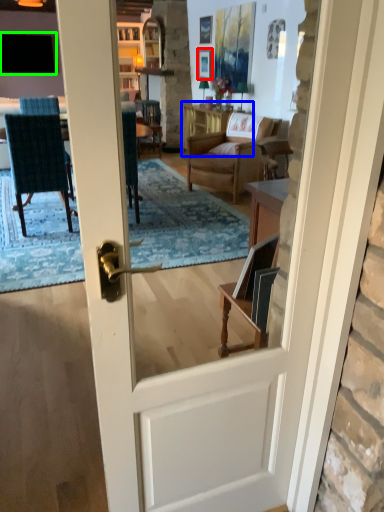
Question: Estimate the real-world distances between objects in this image. Which object is farther from picture frame (highlighted by a red box), table (highlighted by a blue box) or window (highlighted by a green box)?

Choices:
 (A) table
 (B) window

Answer: (B)